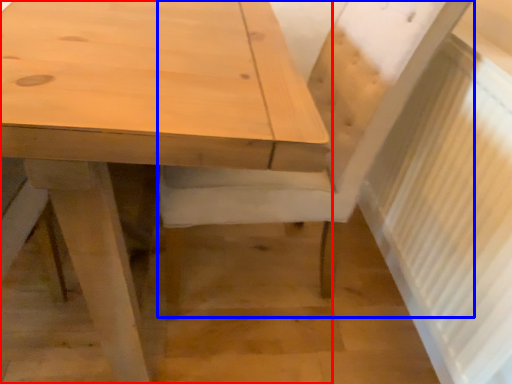
Question: Which of the following is the farthest to the observer, table (highlighted by a red box) or chair (highlighted by a blue box)?

Choices:
 (A) table
 (B) chair

Answer: (B)